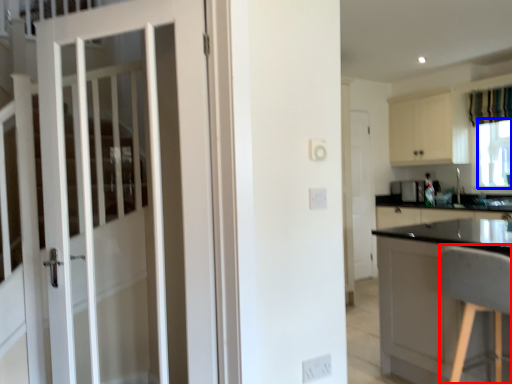
Question: Among these objects, which one is nearest to the camera, chair (highlighted by a red box) or window screen (highlighted by a blue box)?

Choices:
 (A) chair
 (B) window screen

Answer: (A)